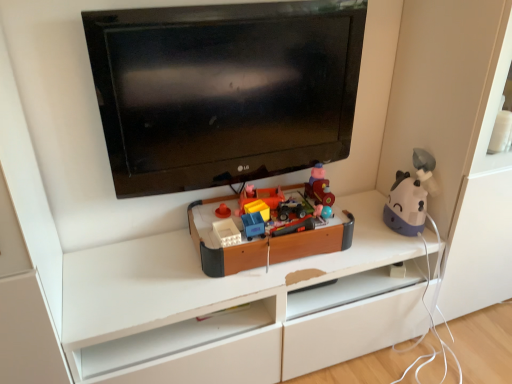
Question: From a real-world perspective, is wooden toy train at center, which ranks as the second toy in right-to-left order, below wooden toy box at center, arranged as the first toy when viewed from the left?

Choices:
 (A) no
 (B) yes

Answer: (A)

Question: Is wooden toy train at center, the second toy viewed from the left, positioned beyond the bounds of wooden toy box at center, arranged as the first toy when viewed from the left?

Choices:
 (A) yes
 (B) no

Answer: (A)

Question: Is wooden toy train at center, the second toy viewed from the left, facing away from wooden toy box at center, arranged as the first toy when viewed from the left?

Choices:
 (A) no
 (B) yes

Answer: (A)

Question: Could you tell me if wooden toy train at center, which ranks as the second toy in right-to-left order, is turned towards wooden toy box at center, arranged as the first toy when viewed from the left?

Choices:
 (A) yes
 (B) no

Answer: (B)

Question: Is wooden toy train at center, the second toy viewed from the left, far from wooden toy box at center, which is the third toy from right to left?

Choices:
 (A) no
 (B) yes

Answer: (A)

Question: Is wooden toy train at center, the second toy viewed from the left, at the right side of wooden toy box at center, arranged as the first toy when viewed from the left?

Choices:
 (A) yes
 (B) no

Answer: (A)

Question: Would you say purple matte humidifier at right, which appears as the first toy when viewed from the right, is outside wooden toy train at center, the second toy viewed from the left?

Choices:
 (A) no
 (B) yes

Answer: (B)

Question: Considering the relative sizes of purple matte humidifier at right, which ranks as the 3th toy in left-to-right order, and wooden toy train at center, which ranks as the second toy in right-to-left order, in the image provided, is purple matte humidifier at right, which ranks as the 3th toy in left-to-right order, shorter than wooden toy train at center, which ranks as the second toy in right-to-left order,?

Choices:
 (A) no
 (B) yes

Answer: (A)

Question: Considering the relative positions of purple matte humidifier at right, which appears as the first toy when viewed from the right, and wooden toy train at center, the second toy viewed from the left, in the image provided, is purple matte humidifier at right, which appears as the first toy when viewed from the right, to the left of wooden toy train at center, the second toy viewed from the left, from the viewer's perspective?

Choices:
 (A) no
 (B) yes

Answer: (A)

Question: Does purple matte humidifier at right, which appears as the first toy when viewed from the right, have a greater width compared to wooden toy train at center, which ranks as the second toy in right-to-left order?

Choices:
 (A) no
 (B) yes

Answer: (B)

Question: Does purple matte humidifier at right, which ranks as the 3th toy in left-to-right order, come in front of wooden toy train at center, which ranks as the second toy in right-to-left order?

Choices:
 (A) no
 (B) yes

Answer: (B)

Question: Would you consider purple matte humidifier at right, which appears as the first toy when viewed from the right, to be distant from wooden toy train at center, the second toy viewed from the left?

Choices:
 (A) yes
 (B) no

Answer: (B)

Question: Is black glossy tv at upper center completely or partially outside of wooden toy box at center, arranged as the first toy when viewed from the left?

Choices:
 (A) yes
 (B) no

Answer: (A)